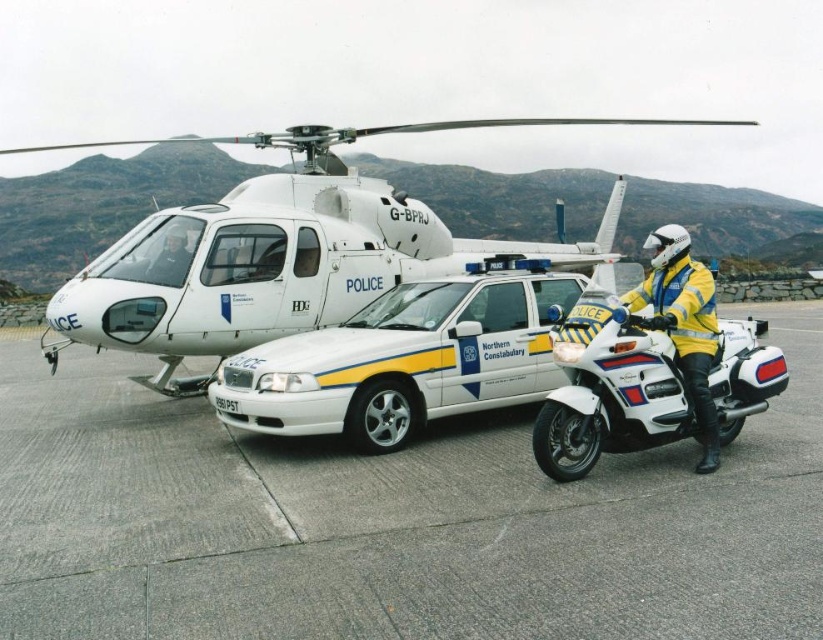
You are a pedestrian standing in front of the white glossy police car at center and the black plastic license plate at center. Which object is positioned to the right?

The white glossy police car at center is positioned to the right of the black plastic license plate at center.

What are the coordinates of the white matte helicopter at upper center?

The white matte helicopter at upper center is located at coordinates point (284,252).

You are a police officer who needs to attach a new license plate to the white glossy police car at center. The current license plate is the black plastic license plate at center. Based on their sizes, will the new license plate fit properly if it has the same dimensions as the existing one?

The white glossy police car at center is taller than the black plastic license plate at center. Since the new license plate has the same dimensions as the existing one, it should fit properly as the car provides sufficient space for it.